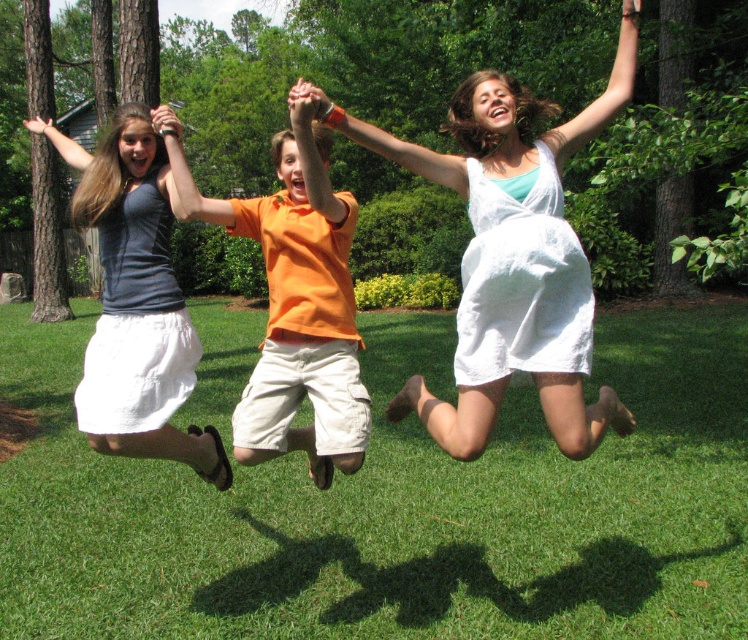
Question: Is orange cotton shirt at center wider than white linen dress at center?

Choices:
 (A) yes
 (B) no

Answer: (B)

Question: Observing the image, what is the correct spatial positioning of green grass at center in reference to matte gray tank top at center?

Choices:
 (A) above
 (B) below

Answer: (B)

Question: Which point is farther from the camera taking this photo?

Choices:
 (A) (82, 497)
 (B) (272, 358)
 (C) (588, 336)

Answer: (A)

Question: From the image, what is the correct spatial relationship of green grass at center in relation to orange cotton shirt at center?

Choices:
 (A) above
 (B) below

Answer: (B)

Question: Which point is farther from the camera taking this photo?

Choices:
 (A) (0, 378)
 (B) (266, 252)
 (C) (162, 218)

Answer: (A)

Question: Which point is farther to the camera?

Choices:
 (A) (378, 369)
 (B) (487, 99)
 (C) (174, 132)
 (D) (312, 340)

Answer: (A)